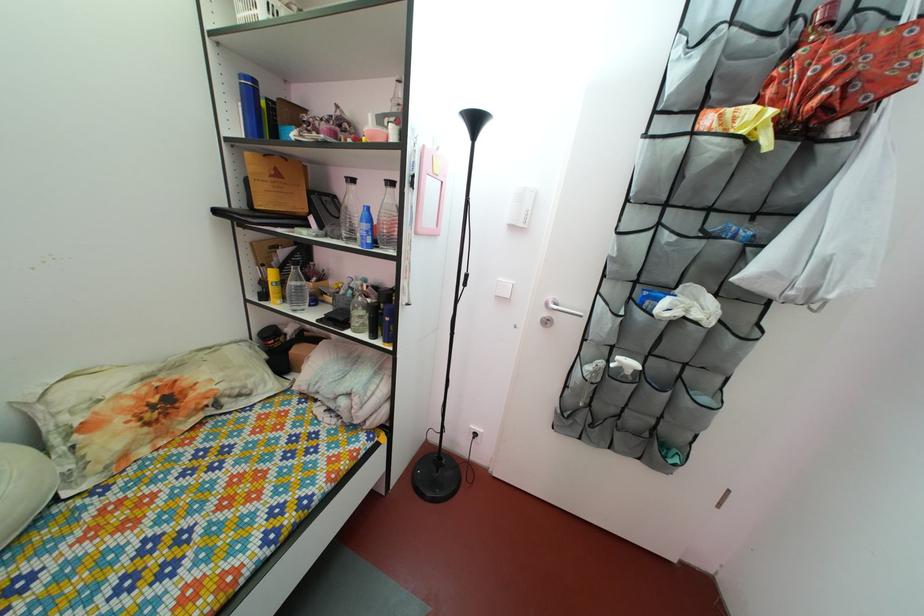
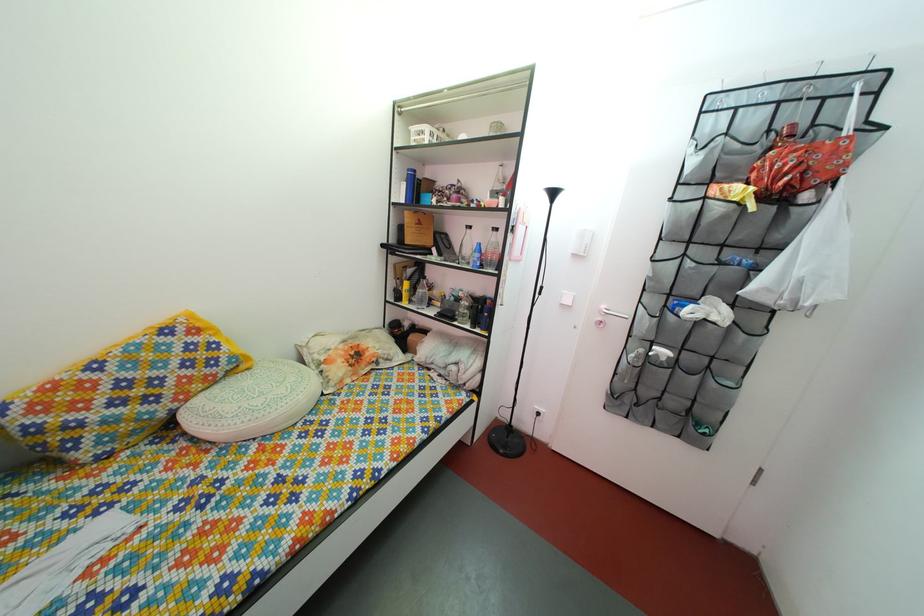
Question: The first image is from the beginning of the video and the second image is from the end. How did the camera likely rotate when shooting the video?

Choices:
 (A) Left
 (B) Right
 (C) Up
 (D) Down

Answer: (A)